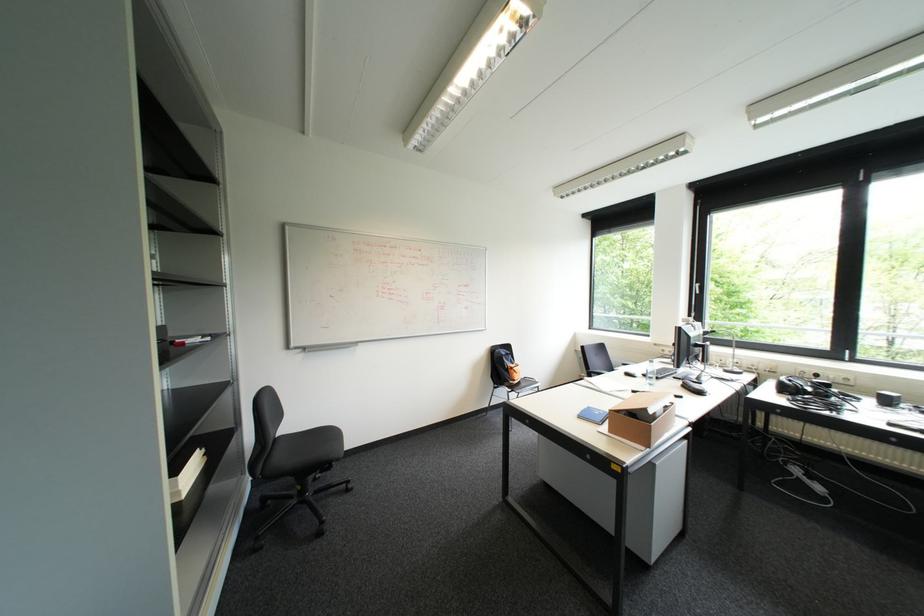
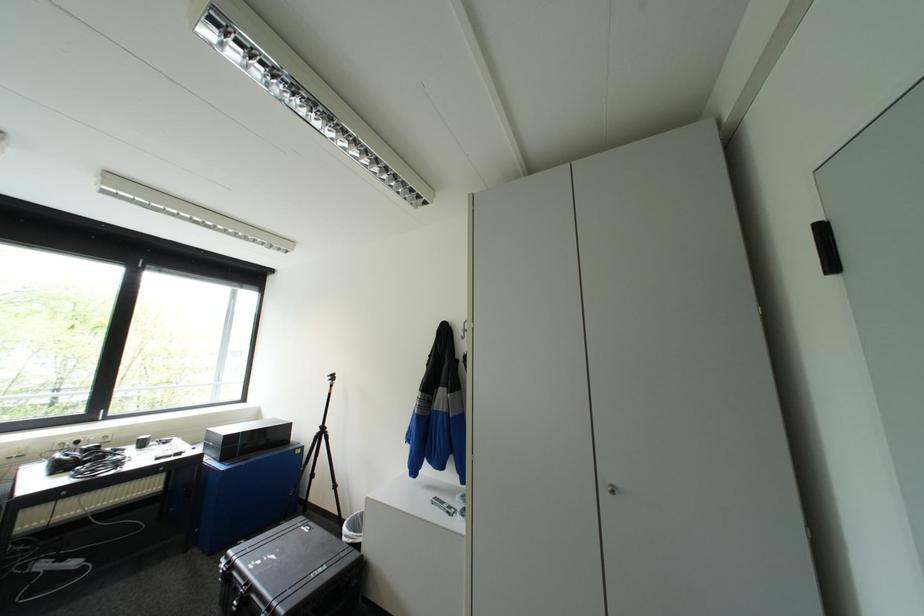
Question: The images are taken continuously from a first-person perspective. In which direction is your viewpoint rotating?

Choices:
 (A) Left
 (B) Right
 (C) Up
 (D) Down

Answer: (B)